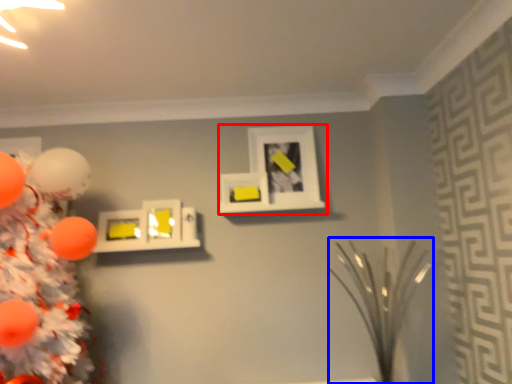
Question: Which object is further to the camera taking this photo, picture frame (highlighted by a red box) or plant (highlighted by a blue box)?

Choices:
 (A) picture frame
 (B) plant

Answer: (A)